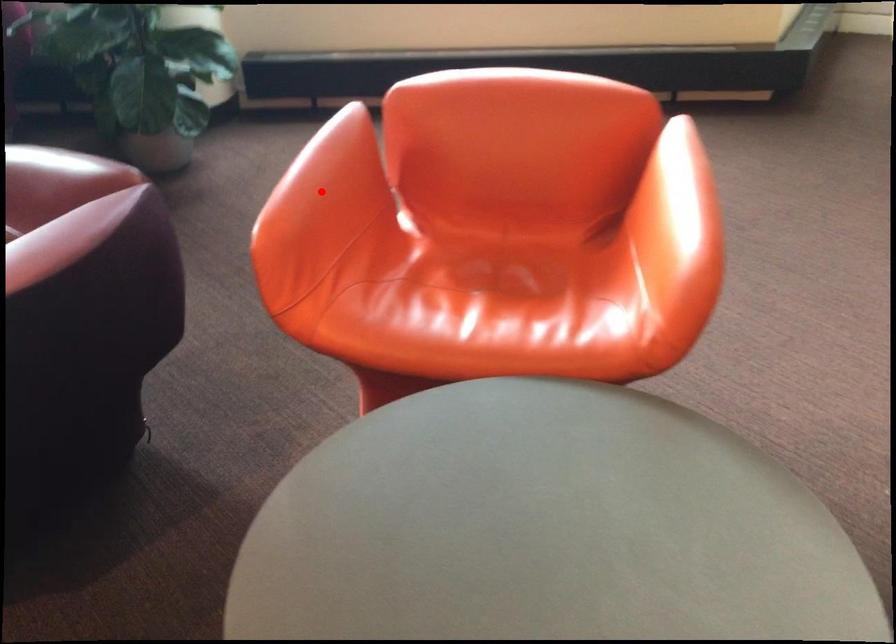
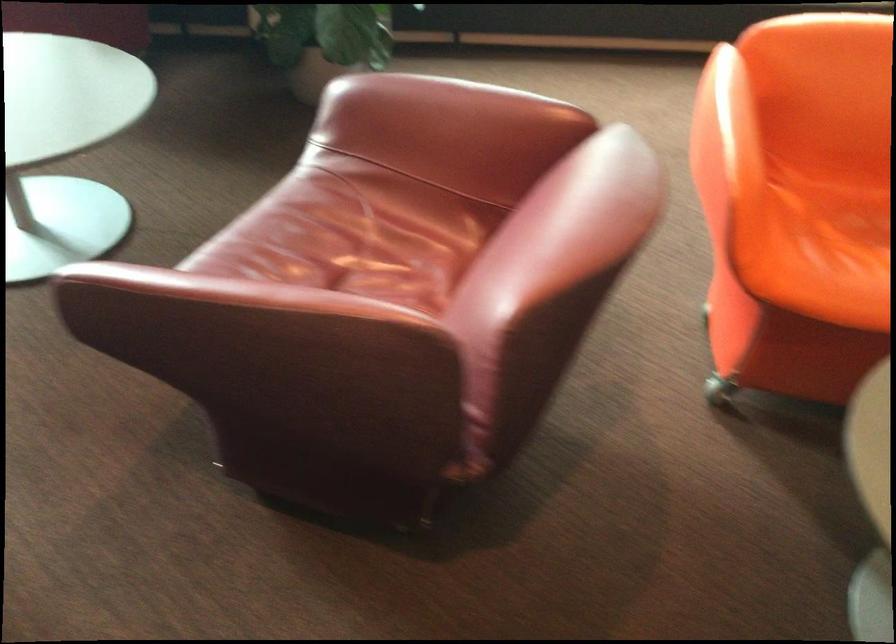
Question: I am providing you with two images of the same scene from different viewpoints. Given a red point in image1, look at the same physical point in image2. Is it:

Choices:
 (A) Closer to the viewpoint
 (B) Farther from the viewpoint

Answer: (B)